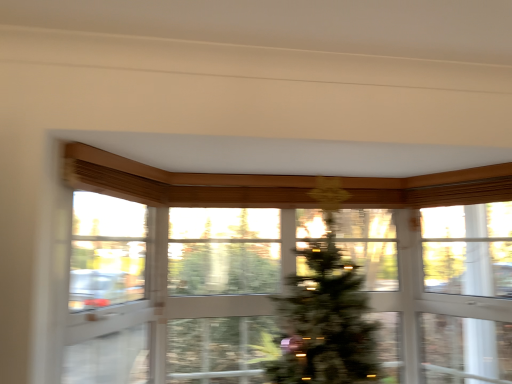
Question: Is transparent glass window screen at upper right to the left of green matte christmas tree at center from the viewer's perspective?

Choices:
 (A) no
 (B) yes

Answer: (A)

Question: Does transparent glass window screen at upper right come in front of green matte christmas tree at center?

Choices:
 (A) no
 (B) yes

Answer: (B)

Question: Is transparent glass window screen at upper right shorter than green matte christmas tree at center?

Choices:
 (A) yes
 (B) no

Answer: (A)

Question: From the image's perspective, is transparent glass window screen at upper right below green matte christmas tree at center?

Choices:
 (A) no
 (B) yes

Answer: (A)

Question: From a real-world perspective, is transparent glass window screen at upper right on top of green matte christmas tree at center?

Choices:
 (A) yes
 (B) no

Answer: (A)

Question: Is transparent glass screen door at left bigger or smaller than green matte christmas tree at center?

Choices:
 (A) big
 (B) small

Answer: (B)

Question: Relative to green matte christmas tree at center, is transparent glass screen door at left in front or behind?

Choices:
 (A) behind
 (B) front

Answer: (B)

Question: From the image's perspective, is transparent glass screen door at left above or below green matte christmas tree at center?

Choices:
 (A) below
 (B) above

Answer: (B)

Question: Is point (67, 380) positioned closer to the camera than point (315, 261)?

Choices:
 (A) farther
 (B) closer

Answer: (B)

Question: Considering their positions, is transparent glass window screen at upper right located in front of or behind green matte christmas tree at center?

Choices:
 (A) front
 (B) behind

Answer: (A)

Question: Is transparent glass window screen at upper right taller or shorter than green matte christmas tree at center?

Choices:
 (A) short
 (B) tall

Answer: (A)

Question: Considering the positions of transparent glass window screen at upper right and green matte christmas tree at center in the image, is transparent glass window screen at upper right bigger or smaller than green matte christmas tree at center?

Choices:
 (A) small
 (B) big

Answer: (A)

Question: Does point (444, 208) appear closer or farther from the camera than point (327, 312)?

Choices:
 (A) closer
 (B) farther

Answer: (B)

Question: In the image, is green matte christmas tree at center positioned in front of or behind transparent glass window at center?

Choices:
 (A) front
 (B) behind

Answer: (B)

Question: Considering the positions of green matte christmas tree at center and transparent glass window at center in the image, is green matte christmas tree at center taller or shorter than transparent glass window at center?

Choices:
 (A) short
 (B) tall

Answer: (B)